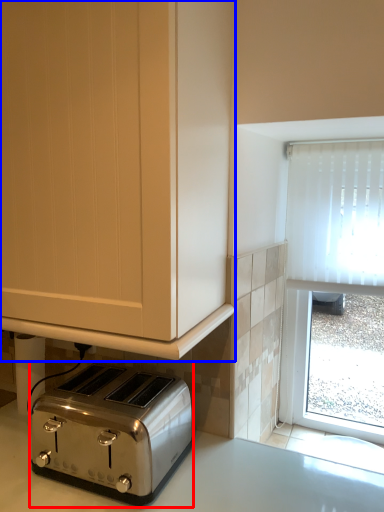
Question: Which object appears closest to the camera in this image, toaster (highlighted by a red box) or cabinetry (highlighted by a blue box)?

Choices:
 (A) toaster
 (B) cabinetry

Answer: (B)